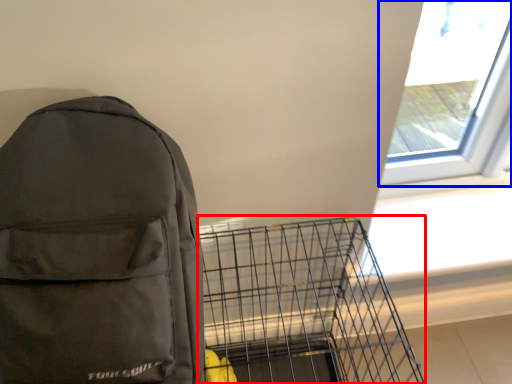
Question: Which of the following is the farthest to the observer, bird cage (highlighted by a red box) or window (highlighted by a blue box)?

Choices:
 (A) bird cage
 (B) window

Answer: (B)